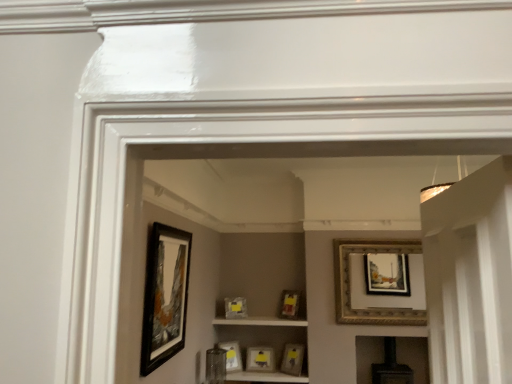
Describe the element at coordinates (232, 356) in the screenshot. I see `matte black picture frame at center, which appears as the 4th picture frame when viewed from the front` at that location.

Measure the distance between gold ornate picture frame at upper right, placed as the first picture frame when sorted from right to left, and camera.

gold ornate picture frame at upper right, placed as the first picture frame when sorted from right to left, and camera are 4.69 meters apart.

What is the approximate height of matte glass cabinet at center?

2.59 inches.

This screenshot has width=512, height=384. Identify the location of matte gray picture frame at center, arranged as the 3th picture frame when viewed from the left. (234, 308).

Considering the positions of objects matte black picture frame at center, positioned as the second picture frame in left-to-right order, and matte gray picture frame at center, acting as the seventh picture frame starting from the front, in the image provided, who is more to the right, matte black picture frame at center, positioned as the second picture frame in left-to-right order, or matte gray picture frame at center, acting as the seventh picture frame starting from the front,?

Positioned to the right is matte gray picture frame at center, acting as the seventh picture frame starting from the front.

Is matte black picture frame at center, positioned as the second picture frame in left-to-right order, looking in the opposite direction of matte gray picture frame at center, which appears as the fifth picture frame when viewed from the right?

No, matte black picture frame at center, positioned as the second picture frame in left-to-right order, is not facing the opposite direction of matte gray picture frame at center, which appears as the fifth picture frame when viewed from the right.

Considering the positions of points (229, 365) and (245, 299), is point (229, 365) closer to camera compared to point (245, 299)?

Yes, point (229, 365) is closer to viewer.

Considering the sizes of objects gold ornate picture frame at upper right, which is the 2th picture frame from front to back, and matte gray picture frame at center, which is counted as the first picture frame, starting from the back, in the image provided, who is bigger, gold ornate picture frame at upper right, which is the 2th picture frame from front to back, or matte gray picture frame at center, which is counted as the first picture frame, starting from the back,?

gold ornate picture frame at upper right, which is the 2th picture frame from front to back, is bigger.

Is gold ornate picture frame at upper right, which is the 2th picture frame from front to back, positioned far away from matte gray picture frame at center, arranged as the 3th picture frame when viewed from the left?

That's right, there is a large distance between gold ornate picture frame at upper right, which is the 2th picture frame from front to back, and matte gray picture frame at center, arranged as the 3th picture frame when viewed from the left.

Based on the photo, is gold ornate picture frame at upper right, which is the 2th picture frame from front to back, facing towards matte gray picture frame at center, arranged as the 3th picture frame when viewed from the left?

No, gold ornate picture frame at upper right, which is the 2th picture frame from front to back, is not facing towards matte gray picture frame at center, arranged as the 3th picture frame when viewed from the left.

Starting from the matte gray picture frame at center, acting as the seventh picture frame starting from the front, which picture frame is the 5th one in front? Please provide its 2D coordinates.

[(348, 283)]

Which is behind, point (249, 319) or point (147, 320)?

The point (249, 319) is farther.

Is matte glass cabinet at center bigger or smaller than black matte picture frame at left, which is counted as the 1th picture frame, starting from the front?

Considering their sizes, matte glass cabinet at center takes up less space than black matte picture frame at left, which is counted as the 1th picture frame, starting from the front.

Does matte glass cabinet at center have a greater width compared to black matte picture frame at left, which is the seventh picture frame in right-to-left order?

Indeed, matte glass cabinet at center has a greater width compared to black matte picture frame at left, which is the seventh picture frame in right-to-left order.

Between point (212, 321) and point (255, 359), which one is positioned in front?

The point (255, 359) is closer to the camera.

Is matte glass cabinet at center positioned before matte black picture frame at center, acting as the 4th picture frame starting from the right?

Yes.

Which of these two, matte glass cabinet at center or matte black picture frame at center, acting as the 4th picture frame starting from the right, is smaller?

Smaller between the two is matte glass cabinet at center.

Is matte glass cabinet at center taller than matte black picture frame at center, placed as the second picture frame when sorted from back to front?

No.

Can you tell me how much matte gold picture frame at center, the third picture frame in the right-to-left sequence, and matte yellow picture frame at center, the fifth picture frame from the back, differ in facing direction?

matte gold picture frame at center, the third picture frame in the right-to-left sequence, and matte yellow picture frame at center, the fifth picture frame from the back, are facing 1.12 degrees away from each other.

Relative to matte yellow picture frame at center, the fifth picture frame from the back, is matte gold picture frame at center, the third picture frame in the right-to-left sequence, in front or behind?

In the image, matte gold picture frame at center, the third picture frame in the right-to-left sequence, appears behind matte yellow picture frame at center, the fifth picture frame from the back.

Is point (286, 294) farther from viewer compared to point (286, 360)?

Yes, point (286, 294) is farther from viewer.

From the picture: Which is more to the left, matte gold picture frame at center, arranged as the 5th picture frame when viewed from the front, or matte yellow picture frame at center, the fifth picture frame from the back?

matte gold picture frame at center, arranged as the 5th picture frame when viewed from the front.

Considering the sizes of objects black matte picture frame at left, the seventh picture frame from the back, and matte gold picture frame at center, arranged as the 5th picture frame when viewed from the front, in the image provided, who is shorter, black matte picture frame at left, the seventh picture frame from the back, or matte gold picture frame at center, arranged as the 5th picture frame when viewed from the front,?

matte gold picture frame at center, arranged as the 5th picture frame when viewed from the front, is shorter.

From the image's perspective, is black matte picture frame at left, which is counted as the 1th picture frame, starting from the front, over matte gold picture frame at center, the 5th picture frame when ordered from left to right?

Correct, black matte picture frame at left, which is counted as the 1th picture frame, starting from the front, appears higher than matte gold picture frame at center, the 5th picture frame when ordered from left to right, in the image.

Looking at this image, considering the sizes of objects black matte picture frame at left, the seventh picture frame from the back, and matte gold picture frame at center, the 5th picture frame when ordered from left to right, in the image provided, who is thinner, black matte picture frame at left, the seventh picture frame from the back, or matte gold picture frame at center, the 5th picture frame when ordered from left to right,?

Thinner between the two is black matte picture frame at left, the seventh picture frame from the back.

Between black matte picture frame at left, which is the seventh picture frame in right-to-left order, and matte gold picture frame at center, which is the third picture frame in back-to-front order, which one appears on the left side from the viewer's perspective?

black matte picture frame at left, which is the seventh picture frame in right-to-left order.

From the picture: In terms of width, does matte yellow picture frame at center, the fifth picture frame from the back, look wider or thinner when compared to matte gold picture frame at center, which is the third picture frame in back-to-front order?

matte yellow picture frame at center, the fifth picture frame from the back, is wider than matte gold picture frame at center, which is the third picture frame in back-to-front order.

Does point (292, 370) come farther from viewer compared to point (290, 301)?

No, (292, 370) is in front of (290, 301).

Which object is further away from the camera, matte yellow picture frame at center, the fifth picture frame from the back, or matte gold picture frame at center, arranged as the 5th picture frame when viewed from the front?

matte gold picture frame at center, arranged as the 5th picture frame when viewed from the front, is behind.

From the image's perspective, who appears lower, matte yellow picture frame at center, the sixth picture frame in the left-to-right sequence, or matte gold picture frame at center, arranged as the 5th picture frame when viewed from the front?

matte yellow picture frame at center, the sixth picture frame in the left-to-right sequence, from the image's perspective.

From a real-world perspective, count 1st picture frames upward from the matte black picture frame at center, which appears as the 4th picture frame when viewed from the front, and point to it. Please provide its 2D coordinates.

[(234, 308)]

From the image's perspective, count 2nd picture frames downward from the gold ornate picture frame at upper right, which is the 2th picture frame from front to back, and point to it. Please provide its 2D coordinates.

[(234, 308)]

Based on their spatial positions, is matte black picture frame at center, arranged as the 6th picture frame when viewed from the front, or black matte picture frame at left, placed as the 1th picture frame when sorted from left to right, closer to matte yellow picture frame at center, the 3th picture frame positioned from the front?

matte black picture frame at center, arranged as the 6th picture frame when viewed from the front.

When comparing their distances from black matte picture frame at left, placed as the 1th picture frame when sorted from left to right, does matte black picture frame at center, the 4th picture frame viewed from the back, or gold ornate picture frame at upper right, placed as the first picture frame when sorted from right to left, seem closer?

The object closer to black matte picture frame at left, placed as the 1th picture frame when sorted from left to right, is matte black picture frame at center, the 4th picture frame viewed from the back.

Based on their spatial positions, is matte black picture frame at center, acting as the 4th picture frame starting from the right, or black matte picture frame at left, which is counted as the 1th picture frame, starting from the front, closer to matte black picture frame at center, marked as the sixth picture frame in a right-to-left arrangement?

Among the two, matte black picture frame at center, acting as the 4th picture frame starting from the right, is located nearer to matte black picture frame at center, marked as the sixth picture frame in a right-to-left arrangement.

From the picture: Looking at the image, which one is located closer to matte black picture frame at center, the 4th picture frame positioned from the left, gold ornate picture frame at upper right, which is the 6th picture frame in back-to-front order, or black matte picture frame at left, which is counted as the 1th picture frame, starting from the front?

Among the two, gold ornate picture frame at upper right, which is the 6th picture frame in back-to-front order, is located nearer to matte black picture frame at center, the 4th picture frame positioned from the left.

In the scene shown: Based on their spatial positions, is matte gold picture frame at center, the 5th picture frame when ordered from left to right, or matte black picture frame at center, the 4th picture frame viewed from the back, further from matte black picture frame at center, acting as the 4th picture frame starting from the right?

matte gold picture frame at center, the 5th picture frame when ordered from left to right, lies further to matte black picture frame at center, acting as the 4th picture frame starting from the right, than the other object.

Looking at the image, which one is located closer to matte black picture frame at center, which appears as the 4th picture frame when viewed from the front, black matte picture frame at left, the seventh picture frame from the back, or matte yellow picture frame at center, the fifth picture frame from the back?

matte yellow picture frame at center, the fifth picture frame from the back.

From the image, which object appears to be farther from matte glass cabinet at center, matte gray picture frame at center, acting as the seventh picture frame starting from the front, or matte black picture frame at center, placed as the second picture frame when sorted from back to front?

Based on the image, matte black picture frame at center, placed as the second picture frame when sorted from back to front, appears to be further to matte glass cabinet at center.

Based on their spatial positions, is matte gray picture frame at center, acting as the seventh picture frame starting from the front, or matte glass cabinet at center closer to matte gold picture frame at center, the 5th picture frame when ordered from left to right?

matte glass cabinet at center lies closer to matte gold picture frame at center, the 5th picture frame when ordered from left to right, than the other object.

I want to click on cabinet positioned between black matte picture frame at left, placed as the 1th picture frame when sorted from left to right, and matte gold picture frame at center, the 5th picture frame when ordered from left to right, from near to far, so click(260, 321).

You are a GUI agent. You are given a task and a screenshot of the screen. Output one action in this format:
    pyautogui.click(x=<x>, y=<y>)
    Task: Click on the cabinet situated between matte black picture frame at center, positioned as the second picture frame in left-to-right order, and gold ornate picture frame at upper right, placed as the first picture frame when sorted from right to left, from left to right
    
    Given the screenshot: What is the action you would take?
    pyautogui.click(x=260, y=321)

Locate an element on the screen. cabinet between matte gray picture frame at center, which appears as the fifth picture frame when viewed from the right, and matte yellow picture frame at center, the 3th picture frame positioned from the front, from left to right is located at coordinates (260, 321).

This screenshot has width=512, height=384. I want to click on cabinet between matte gray picture frame at center, which appears as the fifth picture frame when viewed from the right, and matte black picture frame at center, positioned as the second picture frame in left-to-right order, in the up-down direction, so click(260, 321).